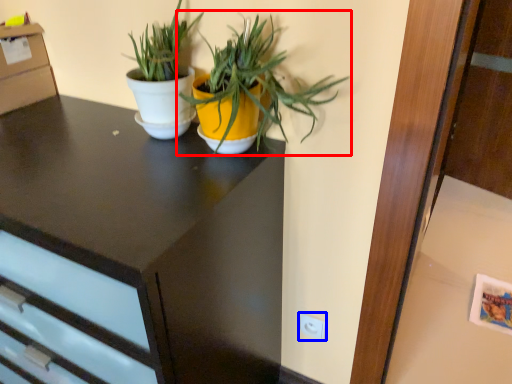
Question: Which object is closer to the camera taking this photo, houseplant (highlighted by a red box) or electric outlet (highlighted by a blue box)?

Choices:
 (A) houseplant
 (B) electric outlet

Answer: (A)